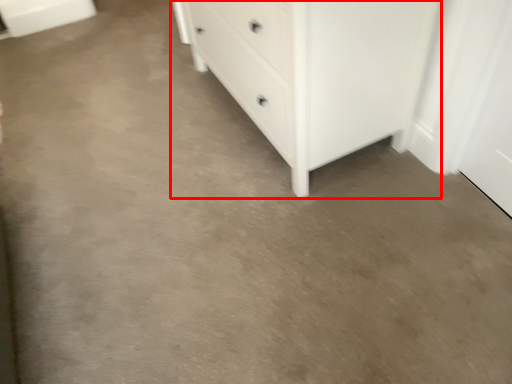
Question: Where is chest of drawers (annotated by the red box) located in relation to cabinetry in the image?

Choices:
 (A) left
 (B) right

Answer: (B)